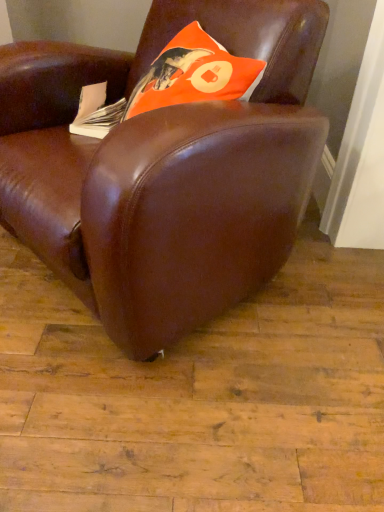
Question: From the image's perspective, relative to brown leather chair at center, is white paper at left above or below?

Choices:
 (A) above
 (B) below

Answer: (A)

Question: Is white paper at left spatially inside brown leather chair at center, or outside of it?

Choices:
 (A) inside
 (B) outside

Answer: (A)

Question: Which object is positioned closest to the white paper at left?

Choices:
 (A) brown leather chair at center
 (B) orange matte pillow at upper center

Answer: (B)

Question: Which object is the closest to the brown leather chair at center?

Choices:
 (A) orange matte pillow at upper center
 (B) white paper at left

Answer: (A)